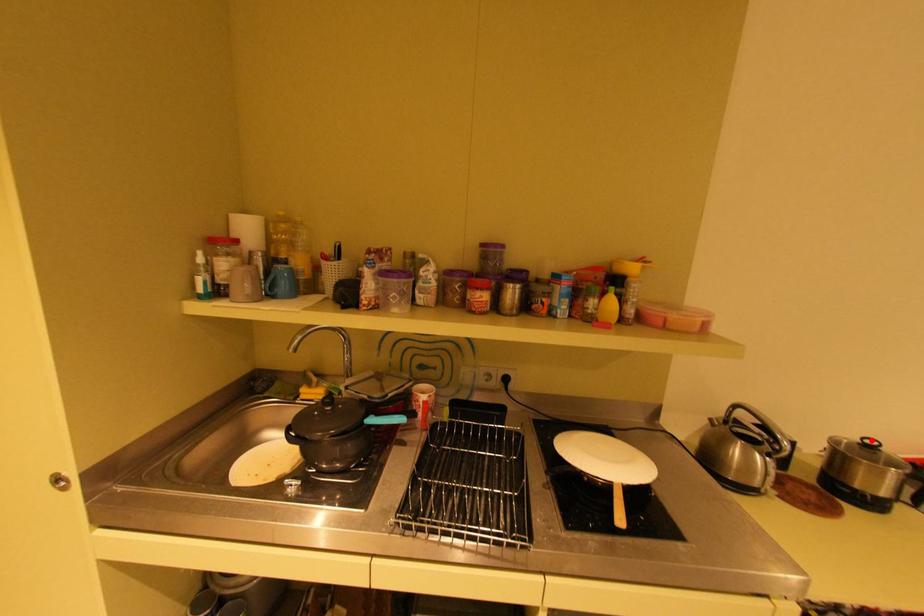
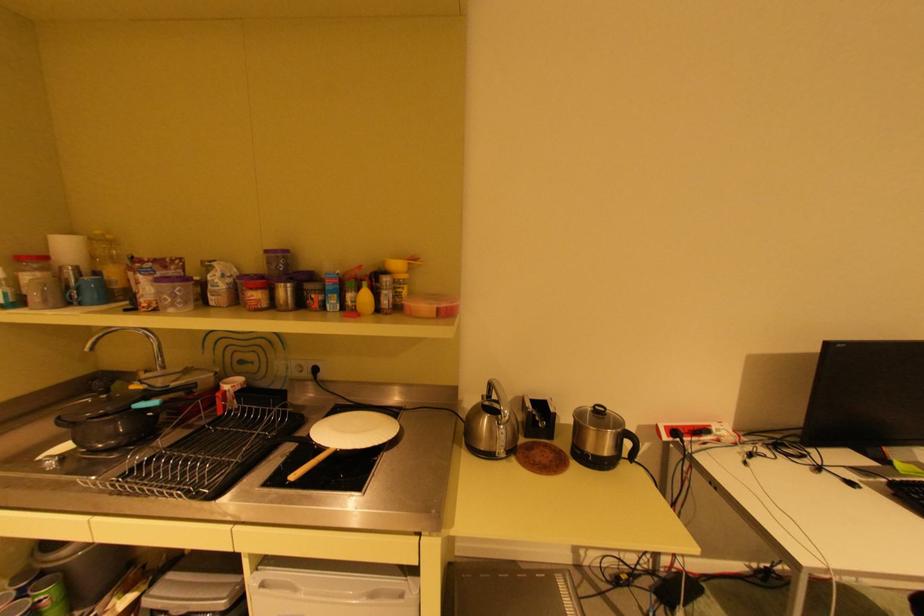
Find the pixel in the second image that matches the highlighted location in the first image.

(602, 407)